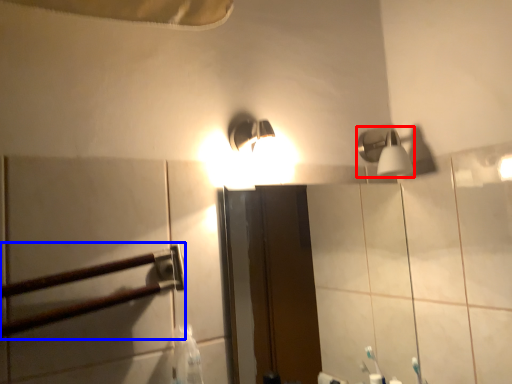
Question: Which of the following is the farthest to the observer, shower (highlighted by a red box) or rail (highlighted by a blue box)?

Choices:
 (A) shower
 (B) rail

Answer: (A)